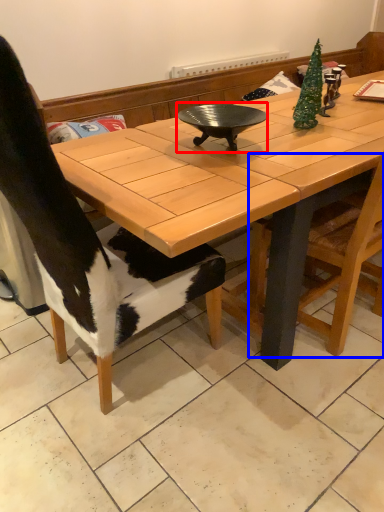
Question: Among these objects, which one is farthest to the camera, wok (highlighted by a red box) or chair (highlighted by a blue box)?

Choices:
 (A) wok
 (B) chair

Answer: (A)